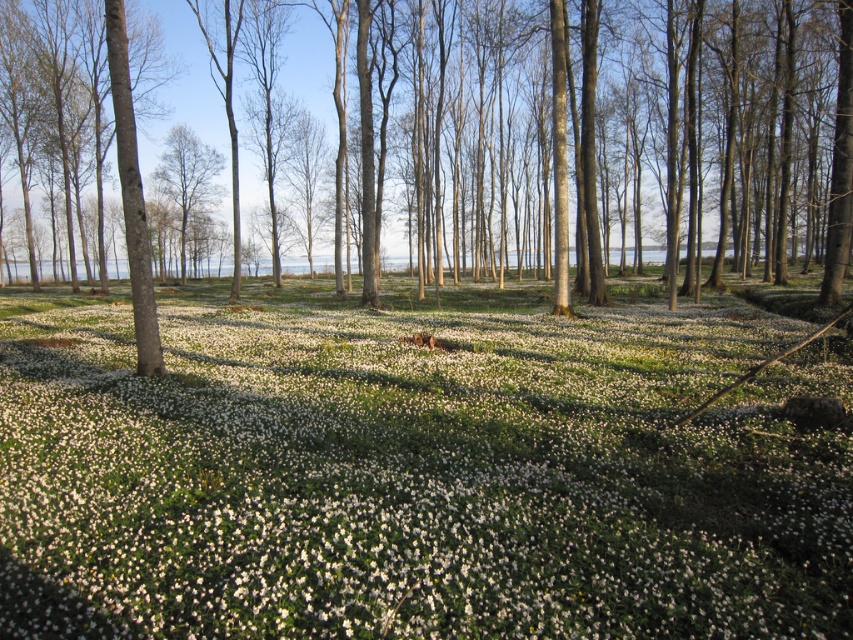
Question: Considering the relative positions of white matte flowers at center and smooth bark tree at center in the image provided, where is white matte flowers at center located with respect to smooth bark tree at center?

Choices:
 (A) right
 (B) left

Answer: (A)

Question: From the image, what is the correct spatial relationship of white matte flowers at center in relation to smooth bark tree at center?

Choices:
 (A) below
 (B) above

Answer: (A)

Question: Which of the following is the farthest from the observer?

Choices:
 (A) (357, 577)
 (B) (178, 252)

Answer: (B)

Question: Is white matte flowers at center in front of smooth bark tree at center?

Choices:
 (A) no
 (B) yes

Answer: (B)